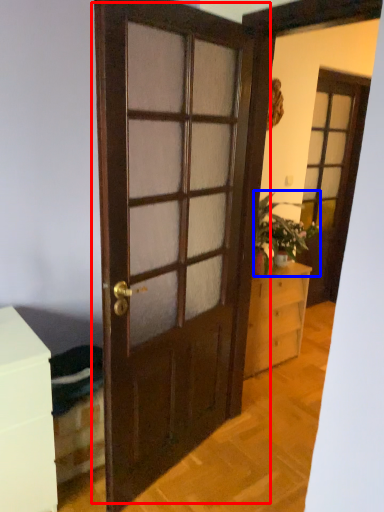
Question: Which object appears closest to the camera in this image, door (highlighted by a red box) or houseplant (highlighted by a blue box)?

Choices:
 (A) door
 (B) houseplant

Answer: (A)